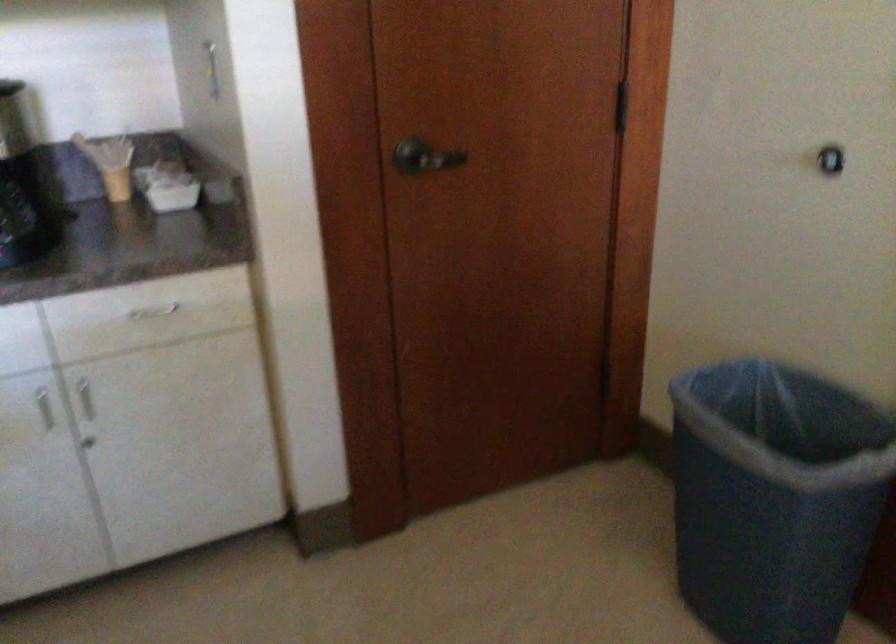
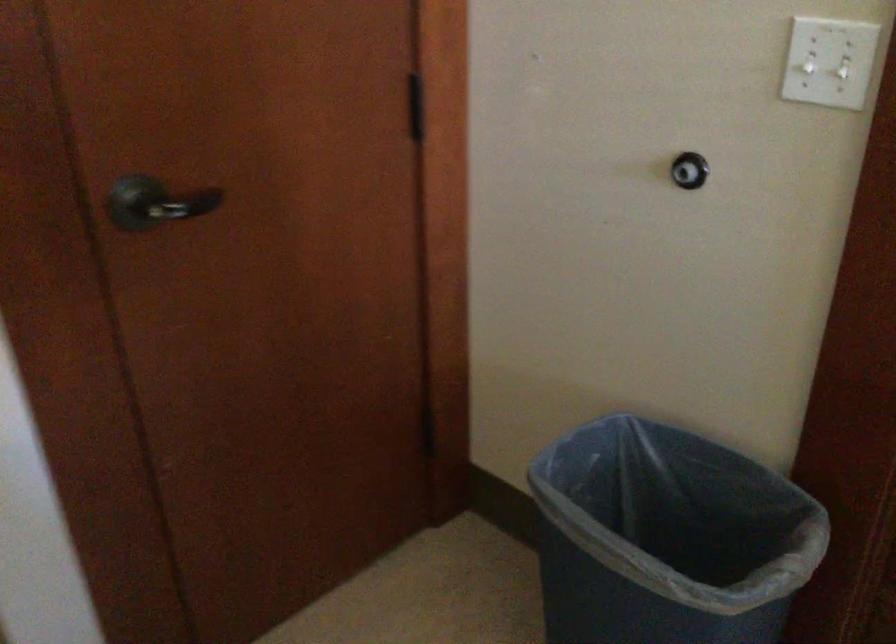
In the second image, find the point that corresponds to pixel 416 154 in the first image.

(156, 203)